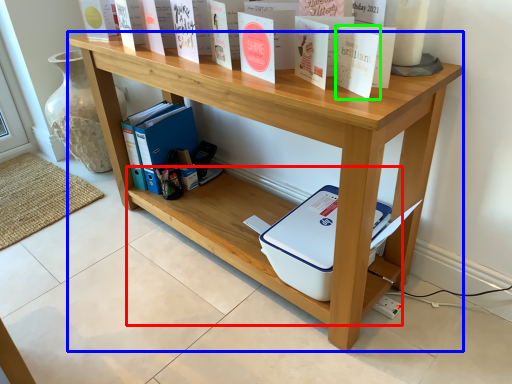
Question: Considering the real-world distances, which object is farthest from shelf (highlighted by a red box)? shelf (highlighted by a blue box) or paperback book (highlighted by a green box)?

Choices:
 (A) shelf
 (B) paperback book

Answer: (B)